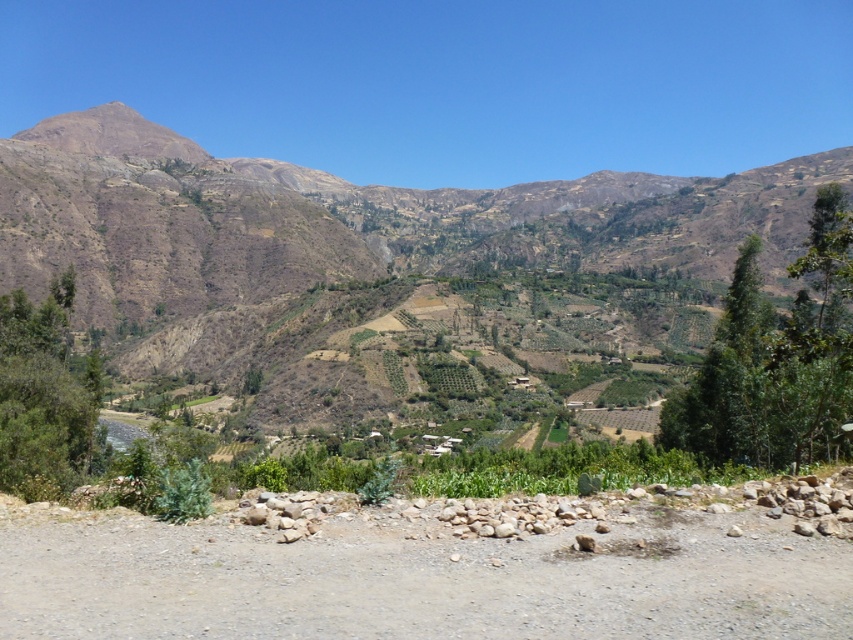
Does brown/drymountain at upper center lie in front of dusty gravel dirt track at lower center?

No, it is not.

Which is below, brown/drymountain at upper center or dusty gravel dirt track at lower center?

dusty gravel dirt track at lower center is below.

Who is more forward, (450, 317) or (149, 621)?

Point (149, 621)

This screenshot has height=640, width=853. I want to click on brown/drymountain at upper center, so point(426,280).